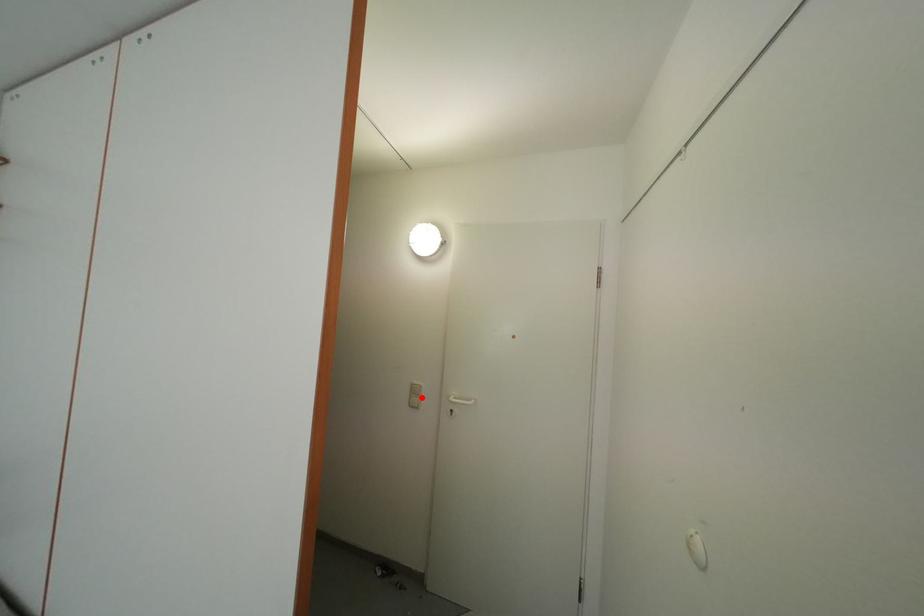
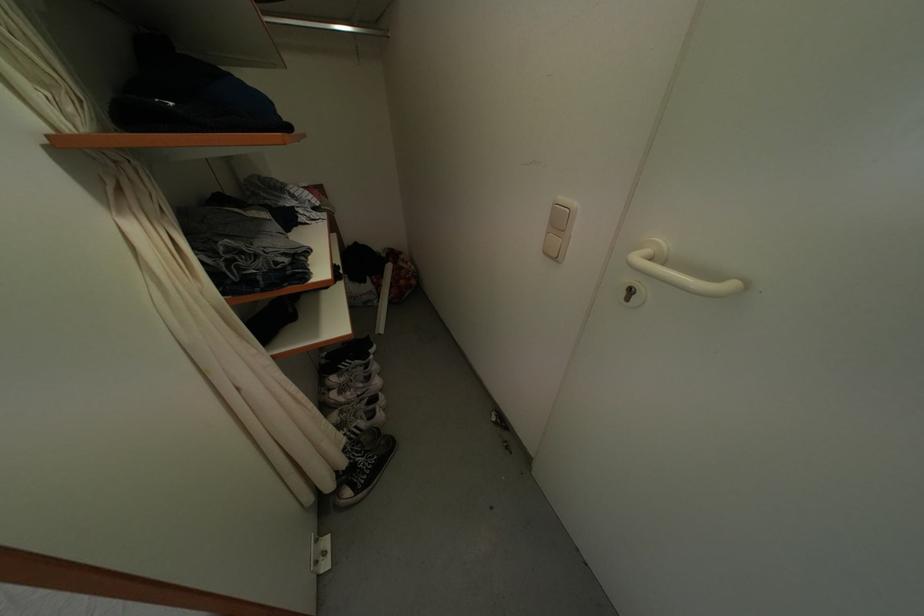
Question: I am providing you with two images of the same scene from different viewpoints. Image1 has a red point marked. In image2, the corresponding 3D location appears at what relative position? Reply with the corresponding letter.

Choices:
 (A) Closer
 (B) Farther

Answer: (A)